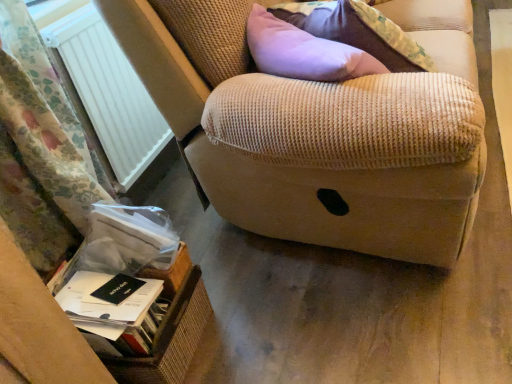
Image resolution: width=512 pixels, height=384 pixels. Find the location of `brown wicker basket at lower left`. brown wicker basket at lower left is located at coordinates (169, 327).

What do you see at coordinates (113, 290) in the screenshot? I see `black matte paperback book at lower left, the second paperback book positioned from the bottom` at bounding box center [113, 290].

What do you see at coordinates (40, 147) in the screenshot? The width and height of the screenshot is (512, 384). I see `floral fabric curtain at left` at bounding box center [40, 147].

Image resolution: width=512 pixels, height=384 pixels. I want to click on beige corduroy armrest at upper right, so click(x=335, y=137).

From the image's perspective, is white plastic radiator at left above or below floral fabric curtain at left?

white plastic radiator at left is situated higher than floral fabric curtain at left in the image.

Considering their positions, is white plastic radiator at left located in front of or behind floral fabric curtain at left?

Clearly, white plastic radiator at left is behind floral fabric curtain at left.

Between white plastic radiator at left and floral fabric curtain at left, which one has larger size?

Bigger between the two is floral fabric curtain at left.

Can you confirm if white plastic radiator at left is wider than floral fabric curtain at left?

Incorrect, the width of white plastic radiator at left does not surpass that of floral fabric curtain at left.

What's the angular difference between beige corduroy armrest at upper right and brown wicker basket at lower left's facing directions?

There is a 50.5-degree angle between the facing directions of beige corduroy armrest at upper right and brown wicker basket at lower left.

Who is shorter, beige corduroy armrest at upper right or brown wicker basket at lower left?

Standing shorter between the two is brown wicker basket at lower left.

In the scene shown: From the image's perspective, would you say beige corduroy armrest at upper right is shown under brown wicker basket at lower left?

No, from the image's perspective, beige corduroy armrest at upper right is not beneath brown wicker basket at lower left.

Considering the points (413, 76) and (106, 340), which point is behind, point (413, 76) or point (106, 340)?

Point (106, 340)

Looking at this image, would you say floral fabric curtain at left is to the left or to the right of beige corduroy armrest at upper right in the picture?

Based on their positions, floral fabric curtain at left is located to the left of beige corduroy armrest at upper right.

Is floral fabric curtain at left inside or outside of beige corduroy armrest at upper right?

The correct answer is: outside.

Looking at this image, considering the relative sizes of floral fabric curtain at left and beige corduroy armrest at upper right in the image provided, is floral fabric curtain at left shorter than beige corduroy armrest at upper right?

In fact, floral fabric curtain at left may be taller than beige corduroy armrest at upper right.

Based on the photo, which of these two, floral fabric curtain at left or beige corduroy armrest at upper right, is smaller?

Smaller between the two is beige corduroy armrest at upper right.

Is white paper at lower left, the second paperback book from the top, surrounded by white plastic radiator at left?

No, white paper at lower left, the second paperback book from the top, is not surrounded by white plastic radiator at left.

Is white plastic radiator at left looking in the opposite direction of white paper at lower left, the second paperback book from the top?

No, white plastic radiator at left is not facing the opposite direction of white paper at lower left, the second paperback book from the top.

Could you measure the distance between white plastic radiator at left and white paper at lower left, the second paperback book from the top?

24.96 inches.

From a real-world perspective, which object rests below the other?

In real-world perspective, white paper at lower left, the second paperback book from the top, is lower.

From the image's perspective, between white paper at lower left, the second paperback book from the top, and black matte paperback book at lower left, the 1th paperback book viewed from the top, which one is located above?

black matte paperback book at lower left, the 1th paperback book viewed from the top, appears higher in the image.

Between white paper at lower left, the second paperback book from the top, and black matte paperback book at lower left, the second paperback book positioned from the bottom, which one appears on the right side from the viewer's perspective?

white paper at lower left, the second paperback book from the top.

From a real-world perspective, is white plastic radiator at left positioned under beige corduroy armrest at upper right based on gravity?

Correct, in the physical world, white plastic radiator at left is lower than beige corduroy armrest at upper right.

Locate an element on the screen. furniture lying in front of the white plastic radiator at left is located at coordinates (x=335, y=137).

How different are the orientations of white plastic radiator at left and beige corduroy armrest at upper right in degrees?

They differ by 54.8 degrees in their facing directions.

Does white plastic radiator at left have a smaller size compared to beige corduroy armrest at upper right?

Indeed, white plastic radiator at left has a smaller size compared to beige corduroy armrest at upper right.

Which is behind, point (122, 286) or point (407, 199)?

Positioned behind is point (407, 199).

Which is more to the left, black matte paperback book at lower left, the second paperback book positioned from the bottom, or beige corduroy armrest at upper right?

From the viewer's perspective, black matte paperback book at lower left, the second paperback book positioned from the bottom, appears more on the left side.

Is black matte paperback book at lower left, the 1th paperback book viewed from the top, not within beige corduroy armrest at upper right?

Yes.

Can you tell me how much black matte paperback book at lower left, the 1th paperback book viewed from the top, and beige corduroy armrest at upper right differ in facing direction?

The angular difference between black matte paperback book at lower left, the 1th paperback book viewed from the top, and beige corduroy armrest at upper right is 64.6 degrees.

The image size is (512, 384). I want to click on curtain on the left of the white plastic radiator at left, so click(x=40, y=147).

Where is `cardboard box below the beige corduroy armrest at upper right (from the image's perspective)`? The width and height of the screenshot is (512, 384). cardboard box below the beige corduroy armrest at upper right (from the image's perspective) is located at coordinates (169, 327).

Estimate the real-world distances between objects in this image. Which object is closer to brown wicker basket at lower left, floral fabric curtain at left or white plastic radiator at left?

floral fabric curtain at left is closer to brown wicker basket at lower left.

Looking at the image, which one is located closer to white paper at lower left, the second paperback book from the top, black matte paperback book at lower left, the 1th paperback book viewed from the top, or floral fabric curtain at left?

Based on the image, black matte paperback book at lower left, the 1th paperback book viewed from the top, appears to be nearer to white paper at lower left, the second paperback book from the top.

Considering their positions, is black matte paperback book at lower left, the second paperback book positioned from the bottom, positioned further to white plastic radiator at left than brown wicker basket at lower left?

Among the two, black matte paperback book at lower left, the second paperback book positioned from the bottom, is located further to white plastic radiator at left.

Considering their positions, is black matte paperback book at lower left, the 1th paperback book viewed from the top, positioned closer to floral fabric curtain at left than beige corduroy armrest at upper right?

black matte paperback book at lower left, the 1th paperback book viewed from the top.

Which object lies further to the anchor point floral fabric curtain at left, black matte paperback book at lower left, the 1th paperback book viewed from the top, or white paper at lower left, which appears as the first paperback book when ordered from the bottom?

Based on the image, black matte paperback book at lower left, the 1th paperback book viewed from the top, appears to be further to floral fabric curtain at left.

Considering their positions, is floral fabric curtain at left positioned further to black matte paperback book at lower left, the 1th paperback book viewed from the top, than brown wicker basket at lower left?

floral fabric curtain at left lies further to black matte paperback book at lower left, the 1th paperback book viewed from the top, than the other object.

When comparing their distances from black matte paperback book at lower left, the second paperback book positioned from the bottom, does white paper at lower left, the second paperback book from the top, or brown wicker basket at lower left seem closer?

Based on the image, white paper at lower left, the second paperback book from the top, appears to be nearer to black matte paperback book at lower left, the second paperback book positioned from the bottom.

Which object lies nearer to the anchor point floral fabric curtain at left, white plastic radiator at left or black matte paperback book at lower left, the second paperback book positioned from the bottom?

white plastic radiator at left.

Image resolution: width=512 pixels, height=384 pixels. I want to click on curtain between white plastic radiator at left and black matte paperback book at lower left, the second paperback book positioned from the bottom, in the up-down direction, so click(x=40, y=147).

Where is `cardboard box situated between floral fabric curtain at left and beige corduroy armrest at upper right from left to right`? This screenshot has width=512, height=384. cardboard box situated between floral fabric curtain at left and beige corduroy armrest at upper right from left to right is located at coordinates (169, 327).

At what (x,y) coordinates should I click in order to perform the action: click on radiator between floral fabric curtain at left and beige corduroy armrest at upper right in the horizontal direction. Please return your answer as a coordinate pair (x, y). The image size is (512, 384). Looking at the image, I should click on point(110,96).

Image resolution: width=512 pixels, height=384 pixels. Identify the location of paperback book between white plastic radiator at left and white paper at lower left, the second paperback book from the top, in the up-down direction. (113, 290).